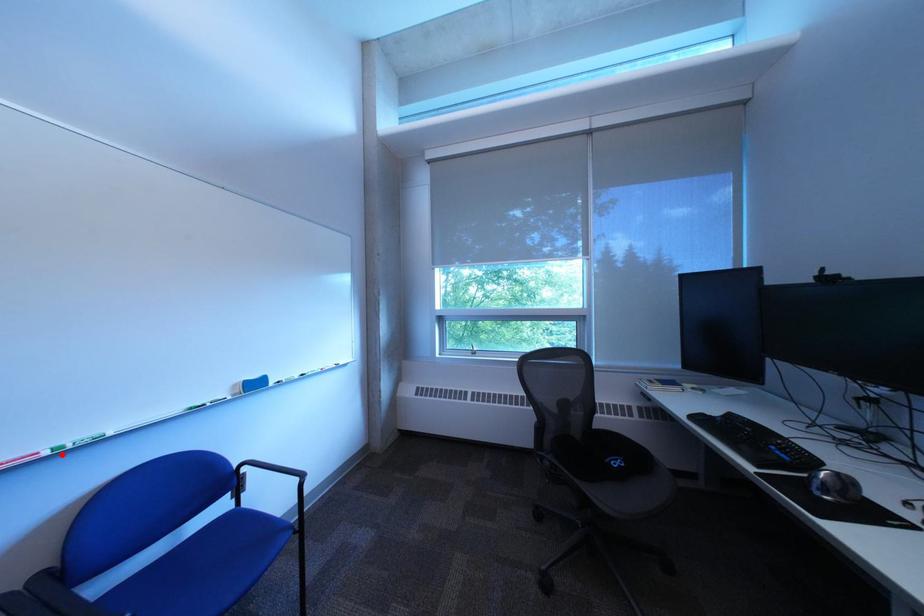
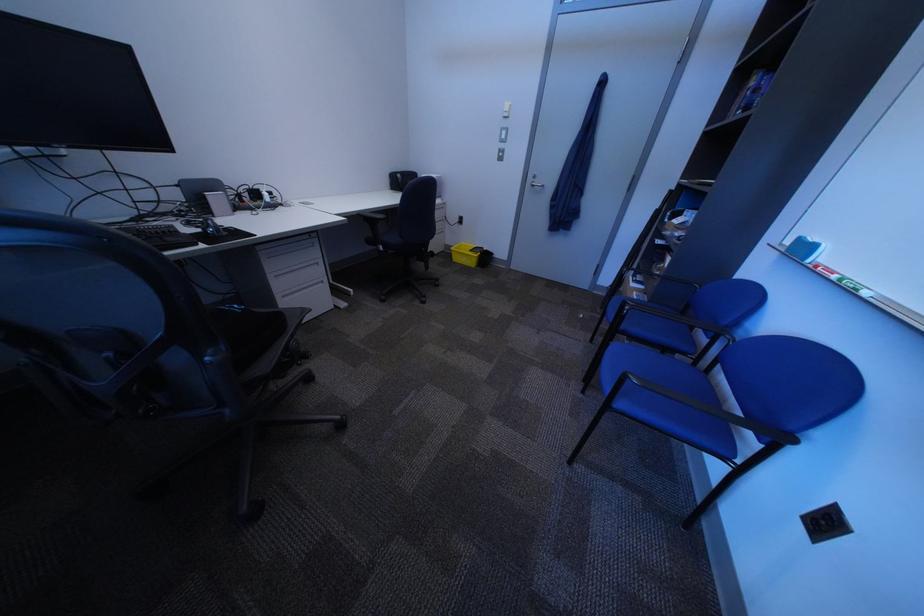
Locate, in the second image, the point that corresponds to the highlighted location in the first image.

(849, 278)